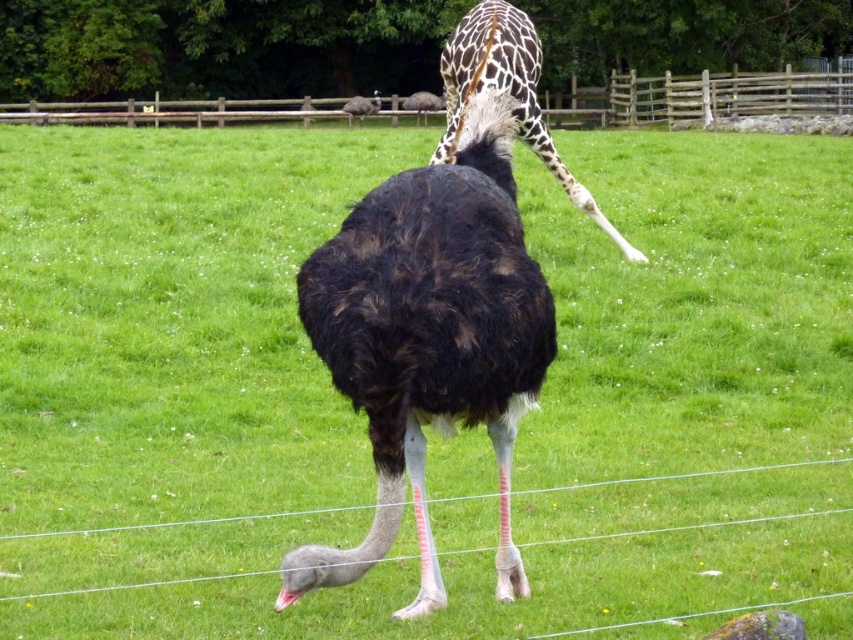
Does dark brown feathers at center have a smaller size compared to wooden fence at upper center?

Correct, dark brown feathers at center occupies less space than wooden fence at upper center.

Between point (378, 448) and point (241, 116), which one is positioned in front?

Positioned in front is point (378, 448).

At what (x,y) coordinates should I click in order to perform the action: click on dark brown feathers at center. Please return your answer as a coordinate pair (x, y). Image resolution: width=853 pixels, height=640 pixels. Looking at the image, I should click on (426, 346).

Is dark brown feathers at center thinner than glossy spotted giraffe at upper center?

Yes.

Between dark brown feathers at center and glossy spotted giraffe at upper center, which one is positioned higher?

glossy spotted giraffe at upper center

Does point (361, 548) lie in front of point (505, 20)?

Yes.

This screenshot has height=640, width=853. Find the location of `dark brown feathers at center`. dark brown feathers at center is located at coordinates (426, 346).

Between wooden fence at upper center and glossy spotted giraffe at upper center, which one appears on the right side from the viewer's perspective?

glossy spotted giraffe at upper center is more to the right.

Is wooden fence at upper center thinner than glossy spotted giraffe at upper center?

Incorrect, wooden fence at upper center's width is not less than glossy spotted giraffe at upper center's.

Describe the element at coordinates (706, 97) in the screenshot. The image size is (853, 640). I see `wooden fence at upper center` at that location.

The image size is (853, 640). Identify the location of wooden fence at upper center. (706, 97).